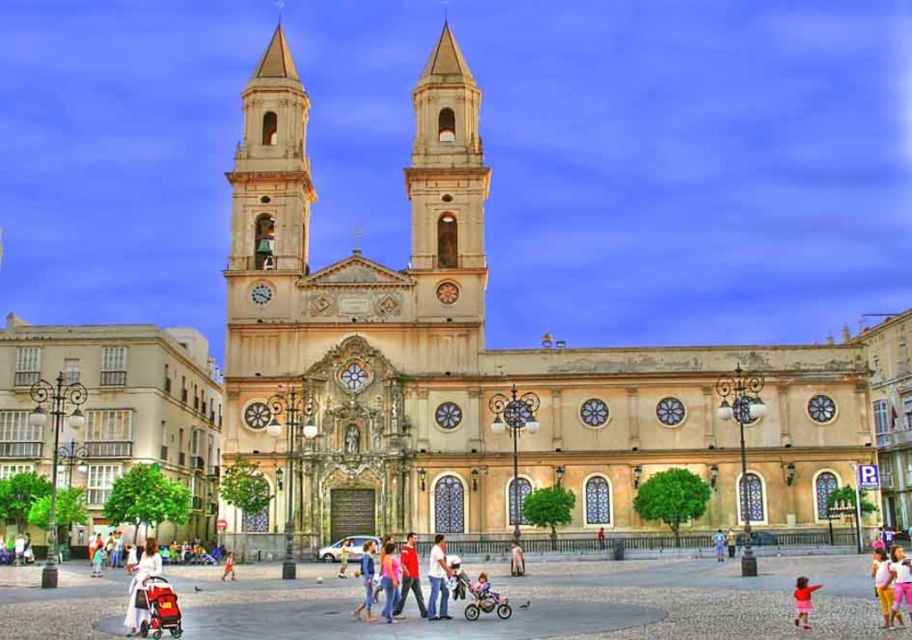
Consider the image. You are a parent with a child in a metallic silver stroller at lower center and you need to reach your friend who is wearing a light brown leather jacket at center. The path between them is clear. Can you push the stroller directly to your friend without moving around any obstacles?

The metallic silver stroller at lower center and light brown leather jacket at center are 31.50 feet apart. Since the path is clear, you can push the stroller directly to your friend without moving around any obstacles.

You are standing at the entrance of the grand historic church and want to walk directly towards the smooth stone pavement at center. Based on the scene description, in which direction should you walk relative to the entrance?

The smooth stone pavement at center is located at point (553,602), which is to the right and slightly forward from the entrance. Therefore, you should walk towards the right and forward from the entrance to reach it.

You are standing in front of the church and see the point marked at coordinates point (553,602). What is the surface material of the ground at that point?

The point (553,602) is on smooth stone pavement at center.